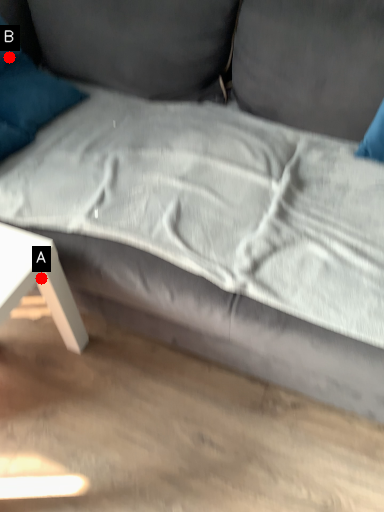
Question: Two points are circled on the image, labeled by A and B beside each circle. Which point is farther from the camera taking this photo?

Choices:
 (A) A is further
 (B) B is further

Answer: (B)